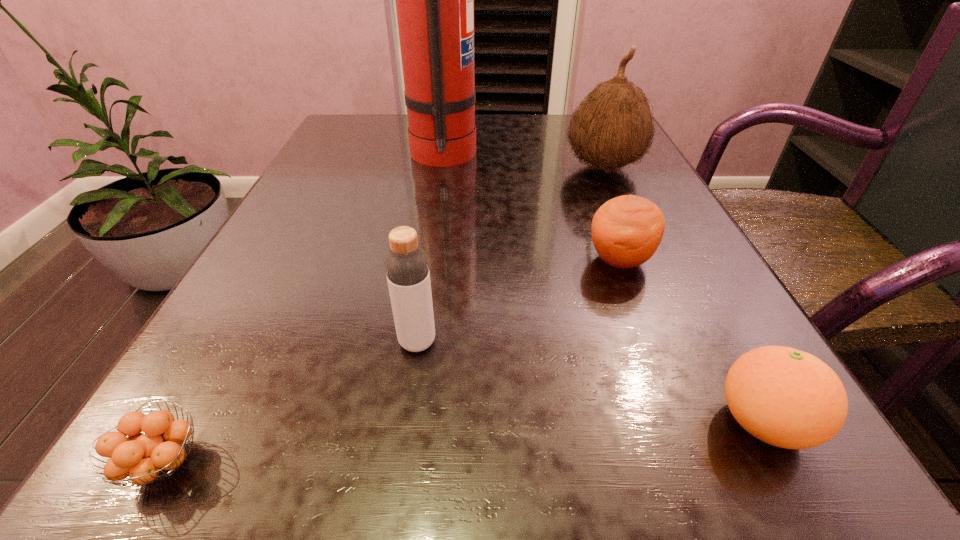
The width and height of the screenshot is (960, 540). I want to click on object at the near right corner, so click(785, 397).

What are the coordinates of `free space at the far edge` in the screenshot? It's located at (544, 123).

The height and width of the screenshot is (540, 960). In order to click on vacant space at the near edge of the desktop in this screenshot , I will do `click(489, 490)`.

Identify the location of blank space at the left edge. [x=325, y=247].

This screenshot has height=540, width=960. In order to click on vacant region at the right edge of the desktop in this screenshot , I will do `click(660, 331)`.

Locate an element on the screen. This screenshot has height=540, width=960. vacant space at the far left corner of the desktop is located at coordinates (401, 133).

Find the location of a particular element. The width and height of the screenshot is (960, 540). vacant area between the third tallest object and the third farthest object is located at coordinates [518, 301].

The image size is (960, 540). In order to click on free space between the fire extinguisher and the shortest orange fruit in this screenshot , I will do `click(303, 309)`.

You are a GUI agent. You are given a task and a screenshot of the screen. Output one action in this format:
    pyautogui.click(x=<x>, y=<y>)
    Task: Click on the free spot between the tallest object and the third farthest object
    The width and height of the screenshot is (960, 540).
    Given the screenshot: What is the action you would take?
    531,208

This screenshot has width=960, height=540. In order to click on empty space between the shortest orange fruit and the farthest orange fruit in this screenshot , I will do `click(392, 361)`.